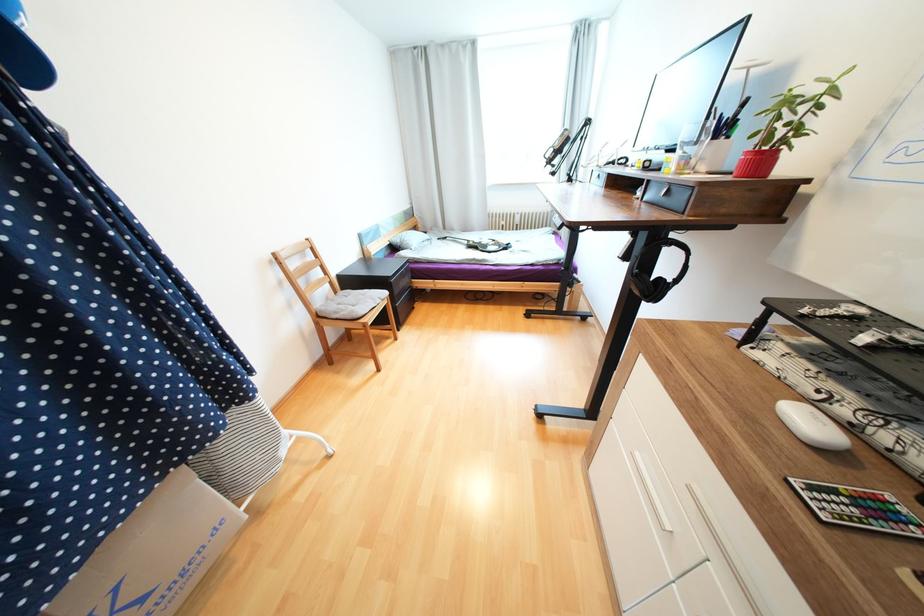
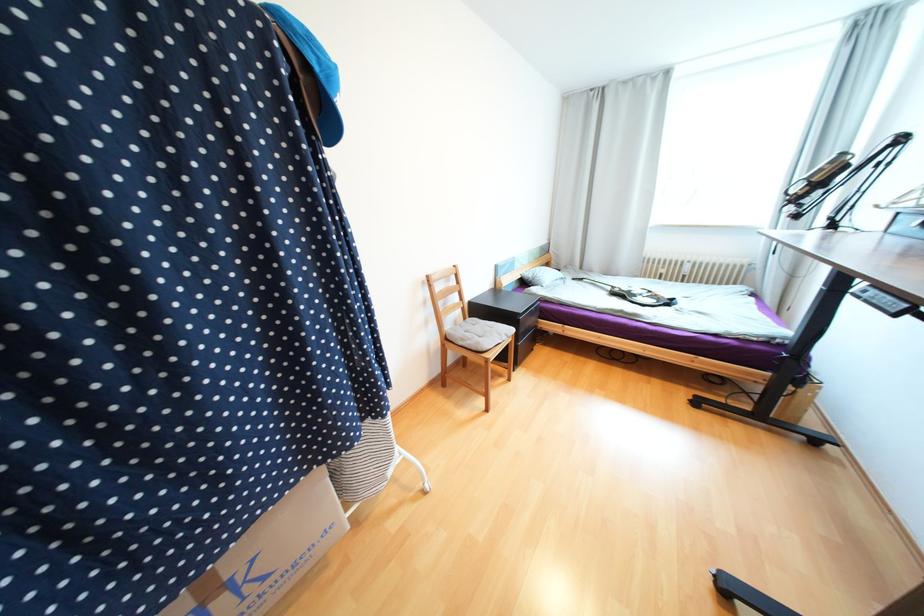
In the second image, find the point that corresponds to [379,300] in the first image.

(505, 334)